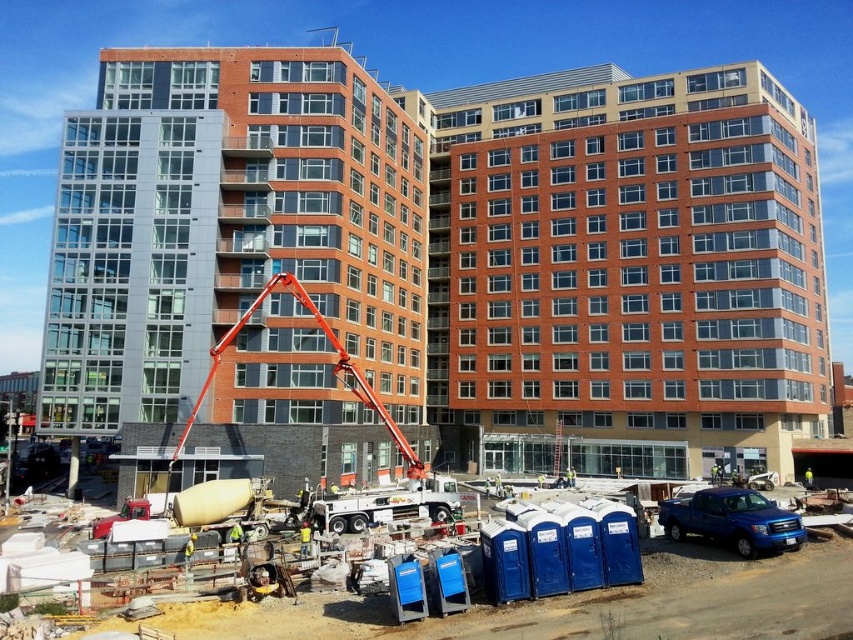
Does matte glass building at center appear under shiny blue truck at lower right?

No, matte glass building at center is not below shiny blue truck at lower right.

Is matte glass building at center above shiny blue truck at lower right?

Yes.

Which is behind, point (107, 49) or point (677, 508)?

Point (107, 49)

In order to click on matte glass building at center in this screenshot , I will do `click(234, 225)`.

Can you confirm if blue plastic port-a-potties at lower center is thinner than orange metallic crane at center?

No.

Based on the photo, between blue plastic port-a-potties at lower center and orange metallic crane at center, which one is positioned lower?

Positioned lower is blue plastic port-a-potties at lower center.

This screenshot has height=640, width=853. Identify the location of blue plastic port-a-potties at lower center. (583, 605).

Which of these two, orange metallic crane at center or yellow hard hat at center, stands shorter?

Standing shorter between the two is yellow hard hat at center.

Between point (225, 336) and point (308, 524), which one is positioned in front?

Point (308, 524) is more forward.

This screenshot has height=640, width=853. In order to click on orange metallic crane at center in this screenshot , I will do `click(332, 372)`.